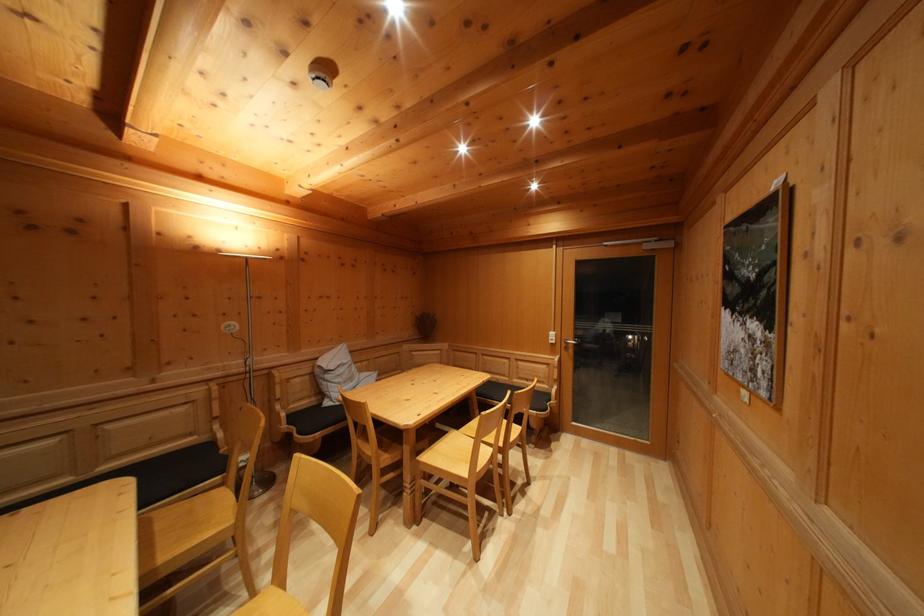
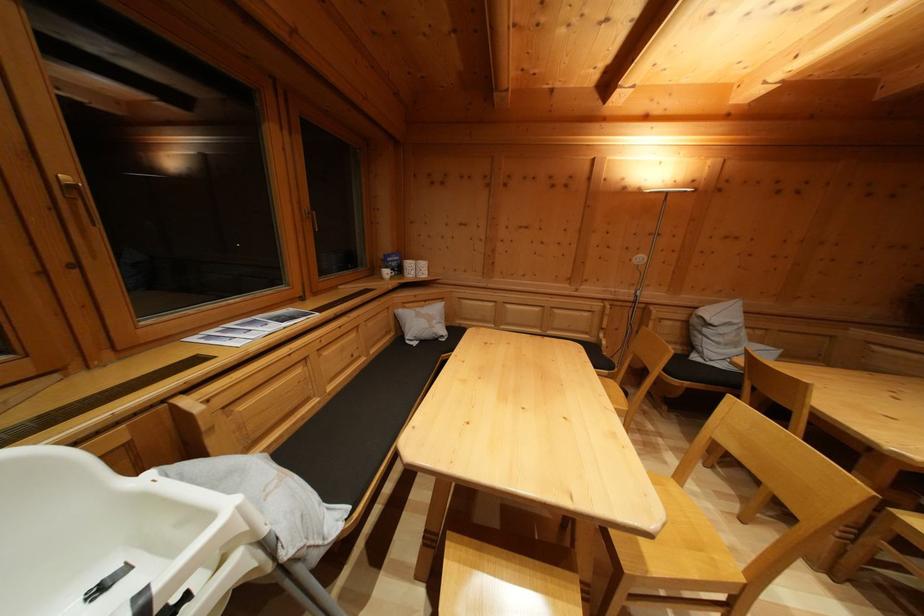
In the second image, find the point that corresponds to point (333, 383) in the first image.

(711, 337)